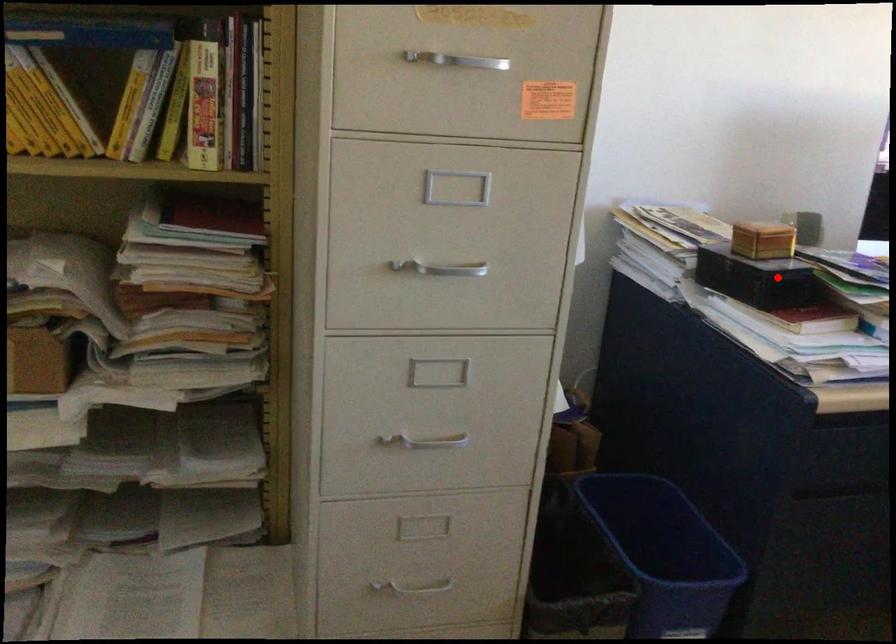
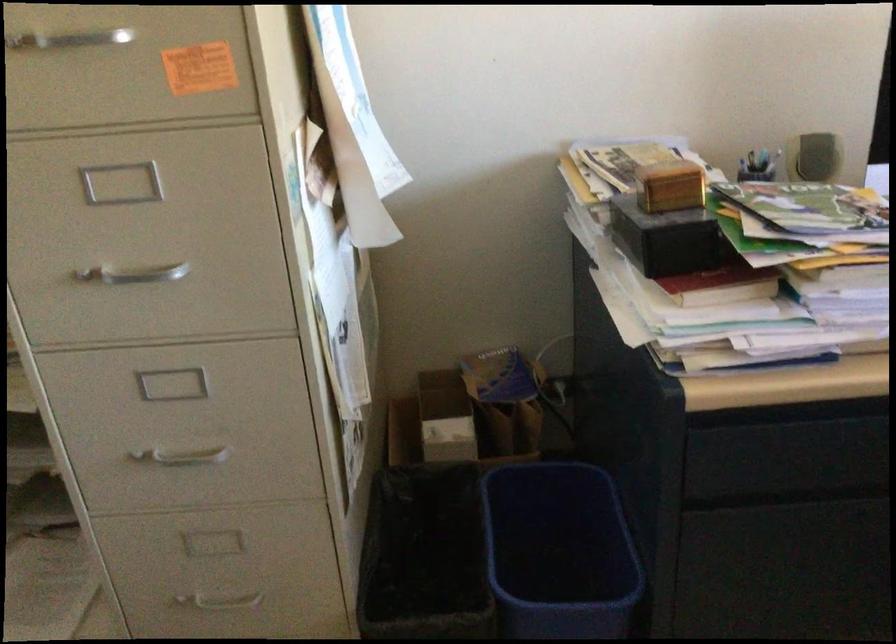
Find the pixel in the second image that matches the highlighted location in the first image.

(668, 239)